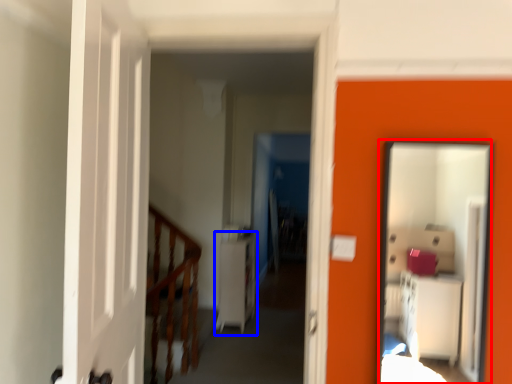
Question: Which object is further to the camera taking this photo, mirror (highlighted by a red box) or dresser (highlighted by a blue box)?

Choices:
 (A) mirror
 (B) dresser

Answer: (B)